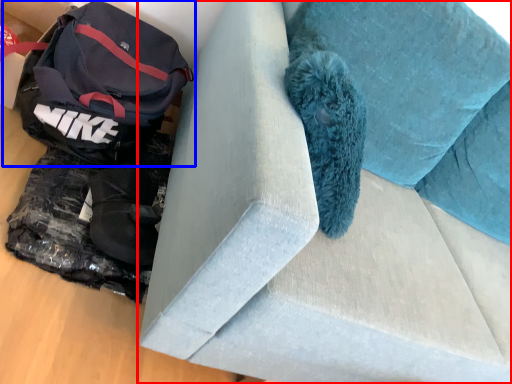
Question: Which object is further to the camera taking this photo, furniture (highlighted by a red box) or luggage and bags (highlighted by a blue box)?

Choices:
 (A) furniture
 (B) luggage and bags

Answer: (B)